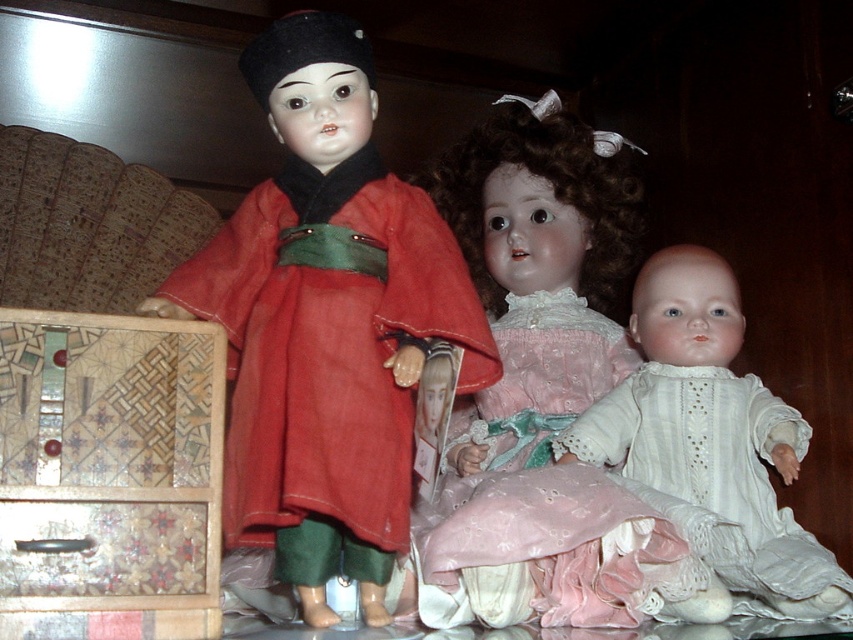
Can you confirm if wooden mosaic drawer at lower left is positioned to the left of wooden drawer at lower left?

In fact, wooden mosaic drawer at lower left is to the right of wooden drawer at lower left.

Who is taller, wooden mosaic drawer at lower left or wooden drawer at lower left?

wooden mosaic drawer at lower left is taller.

Is point (109, 339) more distant than point (3, 593)?

Yes, it is behind point (3, 593).

The width and height of the screenshot is (853, 640). I want to click on wooden mosaic drawer at lower left, so point(109,476).

Is matte red kimono at center above pink lace dress at center?

Yes.

Who is more forward, [398,492] or [445,452]?

Point [398,492] is more forward.

At what (x,y) coordinates should I click in order to perform the action: click on matte red kimono at center. Please return your answer as a coordinate pair (x, y). This screenshot has height=640, width=853. Looking at the image, I should click on (326, 323).

Can you confirm if matte red kimono at center is positioned below wooden mosaic drawer at lower left?

Incorrect, matte red kimono at center is not positioned below wooden mosaic drawer at lower left.

Can you confirm if matte red kimono at center is taller than wooden mosaic drawer at lower left?

Correct, matte red kimono at center is much taller as wooden mosaic drawer at lower left.

I want to click on matte red kimono at center, so click(326, 323).